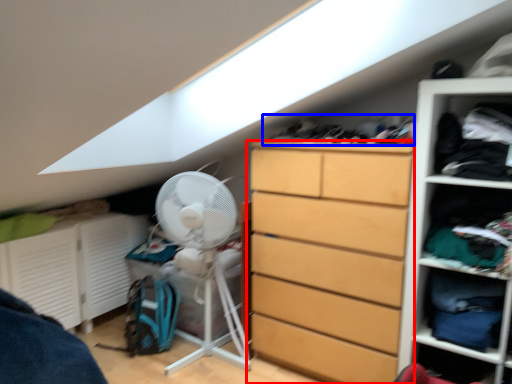
Question: Among these objects, which one is farthest to the camera, chest of drawers (highlighted by a red box) or laundry (highlighted by a blue box)?

Choices:
 (A) chest of drawers
 (B) laundry

Answer: (B)